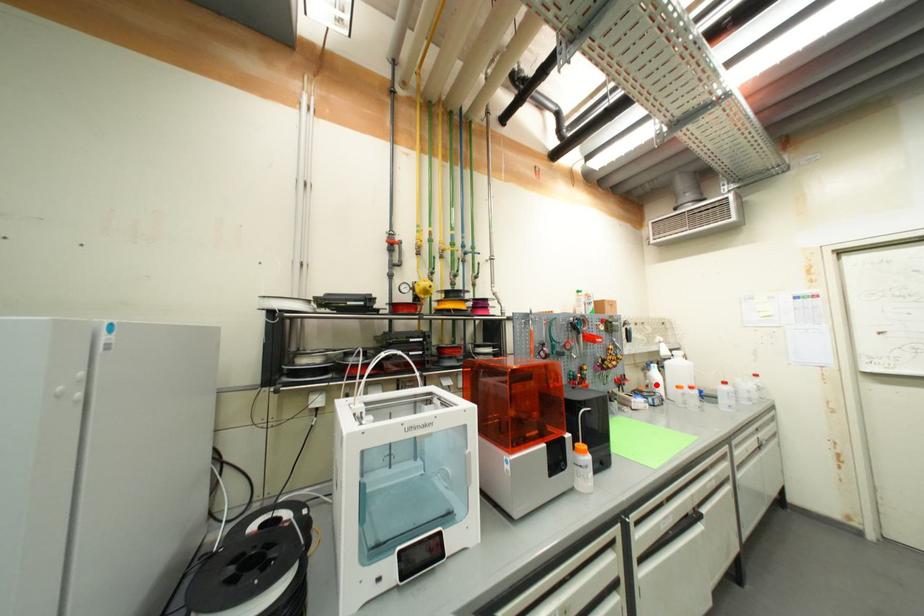
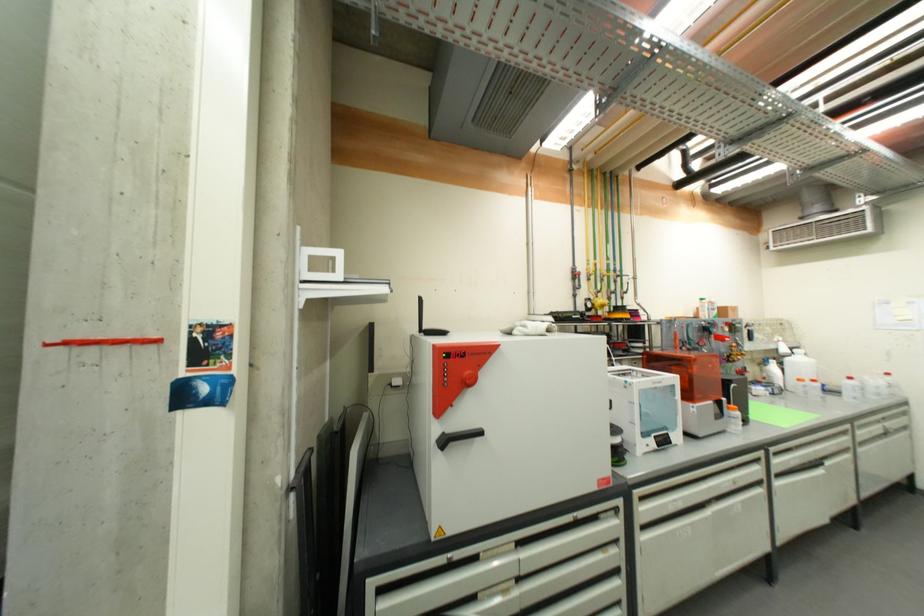
Question: A red point is marked in image1. In image2, is the corresponding 3D point closer to the camera or farther? Reply with the corresponding letter.

Choices:
 (A) The corresponding 3D point is closer.
 (B) The corresponding 3D point is farther.

Answer: (A)